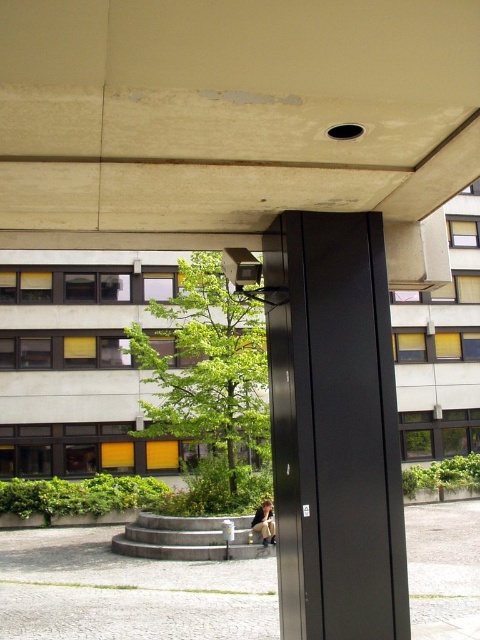
You are standing at the entrance of the building and see the matte black pillar at center and the denim jacket at lower center. Which object is closer to you?

The matte black pillar at center is closer to you because it is in front of the denim jacket at lower center.

You are standing in the urban setting and notice a matte black pillar at center and a denim jacket at lower center. Which object is positioned to the right side from your viewpoint?

The matte black pillar at center is to the right of the denim jacket at lower center, so the matte black pillar at center is positioned to the right side from your viewpoint.